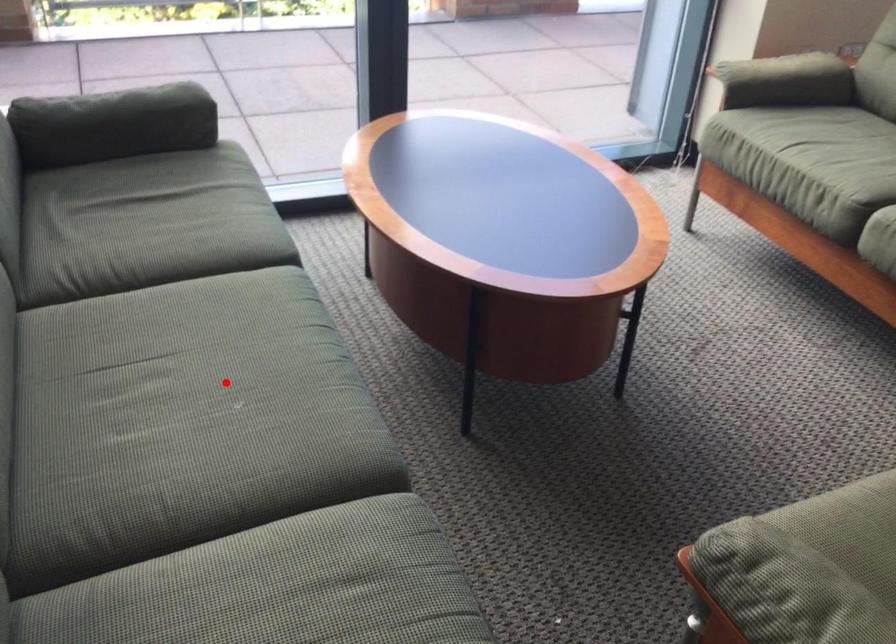
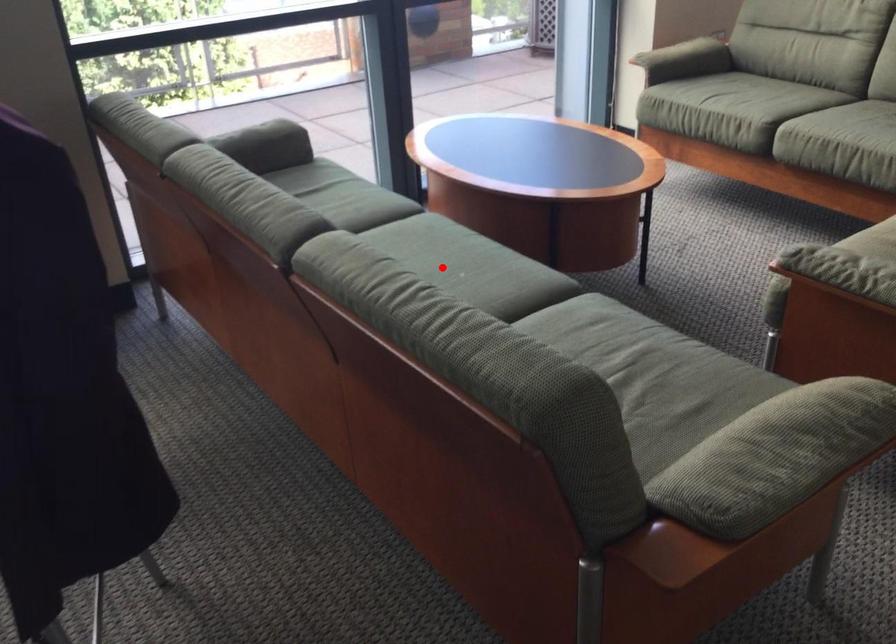
I am providing you with two images of the same scene from different viewpoints. A red point is marked on the first image and another point is marked on the second image. Is the red point in image1 aligned with the point shown in image2?

Yes